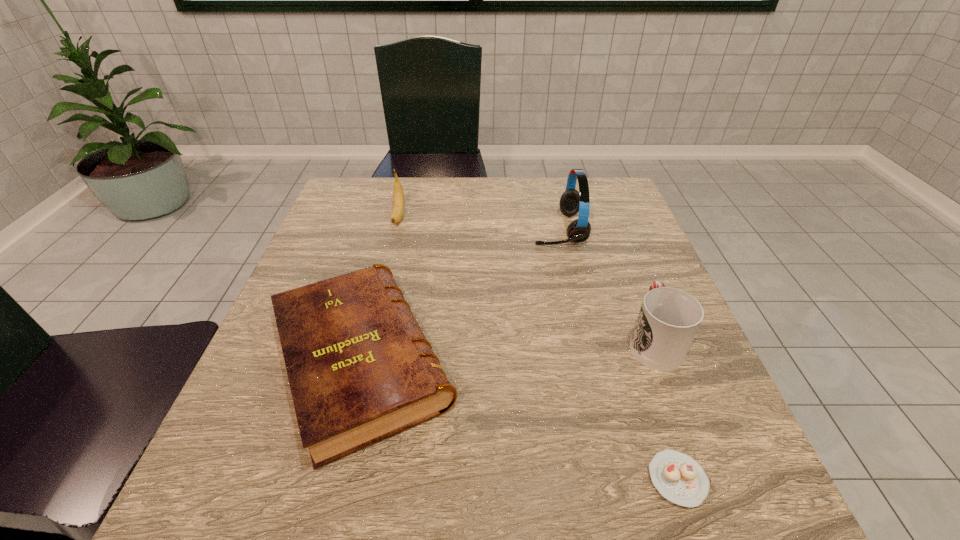
You are a GUI agent. You are given a task and a screenshot of the screen. Output one action in this format:
    pyautogui.click(x=<x>, y=<y>)
    Task: Click on the cup at the right edge
    This screenshot has height=540, width=960.
    Given the screenshot: What is the action you would take?
    (x=669, y=318)

You are a GUI agent. You are given a task and a screenshot of the screen. Output one action in this format:
    pyautogui.click(x=<x>, y=<y>)
    Task: Click on the cupcake located in the right edge section of the desktop
    
    Given the screenshot: What is the action you would take?
    pyautogui.click(x=678, y=477)

Locate an element on the screen. object that is at the near left corner is located at coordinates (360, 369).

This screenshot has height=540, width=960. I want to click on object at the far right corner, so click(x=571, y=202).

Locate an element on the screen. object present at the near right corner is located at coordinates (678, 477).

The image size is (960, 540). In the image, there is a desktop. In order to click on free space at the far edge in this screenshot , I will do `click(557, 181)`.

Find the location of a particular element. This screenshot has height=540, width=960. free space at the near edge of the desktop is located at coordinates (562, 486).

Find the location of a particular element. vacant region at the left edge is located at coordinates (287, 438).

Locate an element on the screen. vacant space at the right edge of the desktop is located at coordinates (603, 305).

Locate an element on the screen. The image size is (960, 540). vacant space at the far left corner of the desktop is located at coordinates (371, 214).